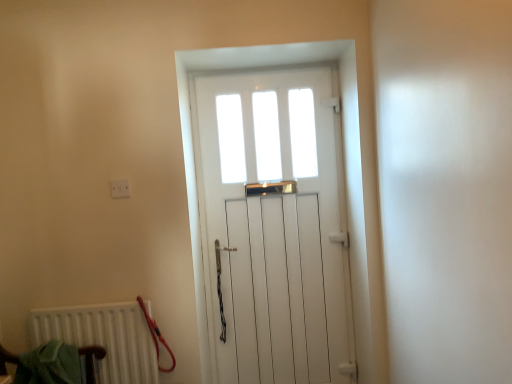
Question: From a real-world perspective, is white plastic electric outlet at upper left positioned above or below white matte radiator at lower left?

Choices:
 (A) above
 (B) below

Answer: (A)

Question: From the image's perspective, relative to white matte radiator at lower left, is white plastic electric outlet at upper left above or below?

Choices:
 (A) above
 (B) below

Answer: (A)

Question: Estimate the real-world distances between objects in this image. Which object is farther from the green fabric armchair at lower left?

Choices:
 (A) white wooden door at center
 (B) white matte radiator at lower left
 (C) white plastic electric outlet at upper left

Answer: (A)

Question: Estimate the real-world distances between objects in this image. Which object is closer to the white matte radiator at lower left?

Choices:
 (A) white plastic electric outlet at upper left
 (B) white wooden door at center
 (C) green fabric armchair at lower left

Answer: (C)